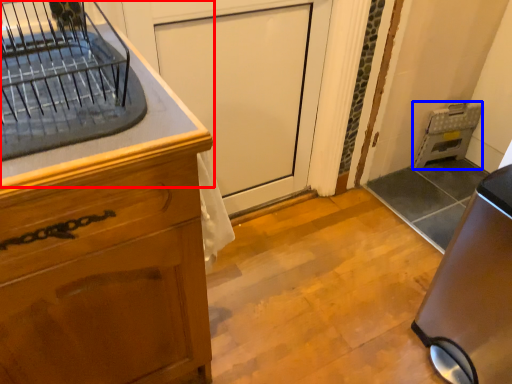
Question: Which point is further to the camera, countertop (highlighted by a red box) or appliance (highlighted by a blue box)?

Choices:
 (A) countertop
 (B) appliance

Answer: (B)